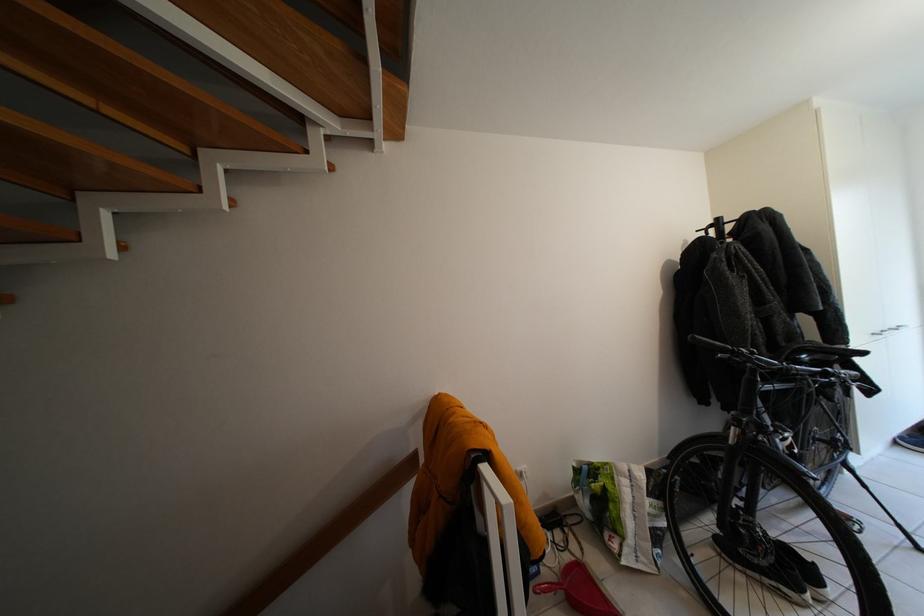
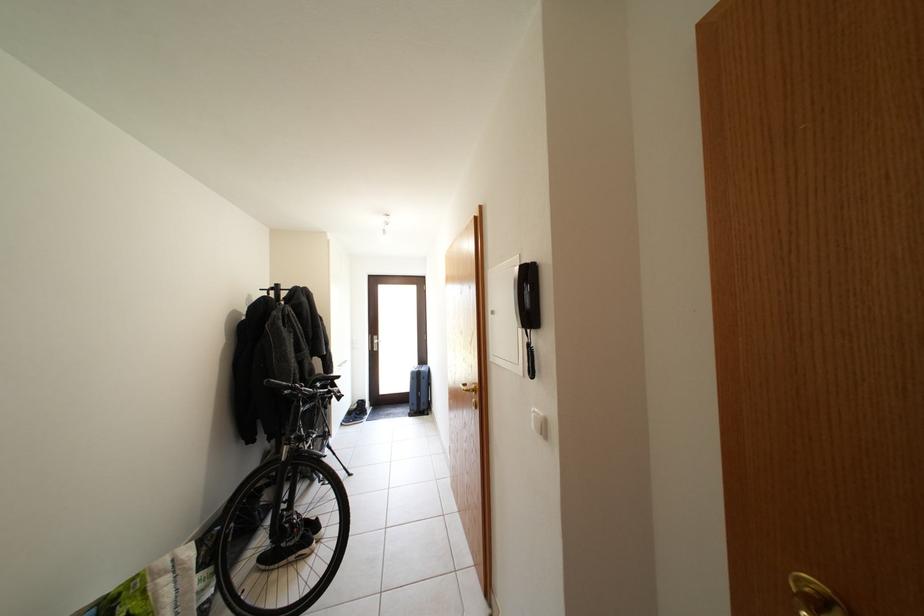
Where in the second image is the point corresponding to (841,360) from the first image?

(336, 386)